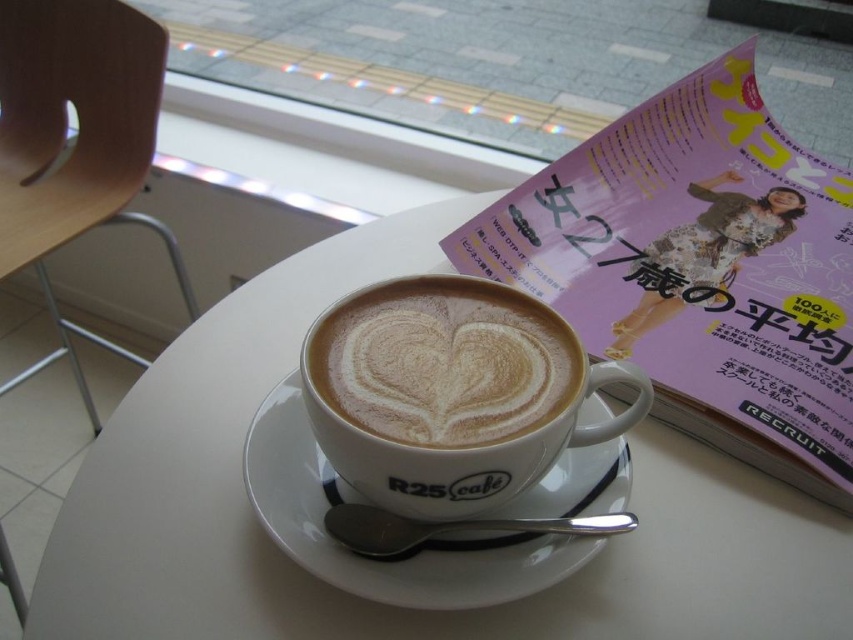
Can you confirm if matte paper magazine at upper right is thinner than white ceramic saucer at center?

No, matte paper magazine at upper right is not thinner than white ceramic saucer at center.

Between point (662, 150) and point (454, 557), which one is positioned in front?

Positioned in front is point (454, 557).

Locate an element on the screen. matte paper magazine at upper right is located at coordinates (699, 269).

Can you confirm if cappuccino foam art at center is wider than white ceramic saucer at center?

Incorrect, cappuccino foam art at center's width does not surpass white ceramic saucer at center's.

Who is positioned more to the right, cappuccino foam art at center or white ceramic saucer at center?

From the viewer's perspective, cappuccino foam art at center appears more on the right side.

You are a GUI agent. You are given a task and a screenshot of the screen. Output one action in this format:
    pyautogui.click(x=<x>, y=<y>)
    Task: Click on the cappuccino foam art at center
    This screenshot has height=640, width=853.
    Given the screenshot: What is the action you would take?
    pyautogui.click(x=444, y=362)

Is point (154, 412) positioned after point (445, 435)?

That is True.

Is white ceramic table at center below cappuccino foam art at center?

Yes.

What do you see at coordinates (367, 602) in the screenshot? Image resolution: width=853 pixels, height=640 pixels. I see `white ceramic table at center` at bounding box center [367, 602].

At what (x,y) coordinates should I click in order to perform the action: click on white ceramic table at center. Please return your answer as a coordinate pair (x, y). Looking at the image, I should click on (367, 602).